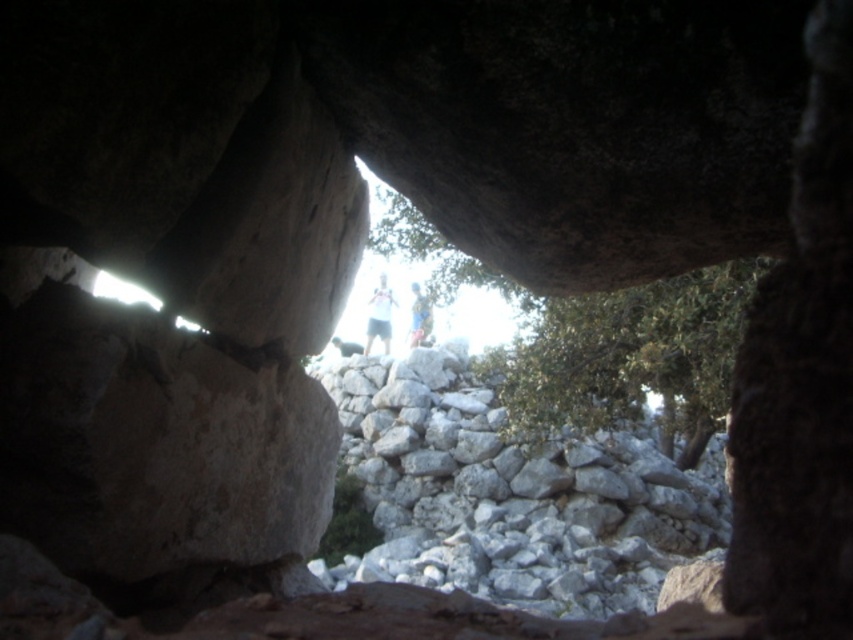
Question: Which point is closer to the camera?

Choices:
 (A) (413, 337)
 (B) (664, 353)
 (C) (663, 512)
 (D) (384, 276)

Answer: (B)

Question: Based on their relative distances, which object is farther from the gray rough stone wall at center?

Choices:
 (A) green leafy tree at center
 (B) blue fabric at center

Answer: (B)

Question: Is gray rough stone wall at center wider than white cotton shirt at center?

Choices:
 (A) no
 (B) yes

Answer: (B)

Question: Which point is closer to the camera?

Choices:
 (A) [x=422, y=320]
 (B) [x=598, y=513]
 (C) [x=579, y=371]

Answer: (C)

Question: From the image, what is the correct spatial relationship of green leafy tree at center in relation to white cotton shirt at center?

Choices:
 (A) right
 (B) left

Answer: (A)

Question: Is green leafy tree at center positioned at the back of white cotton shirt at center?

Choices:
 (A) no
 (B) yes

Answer: (A)